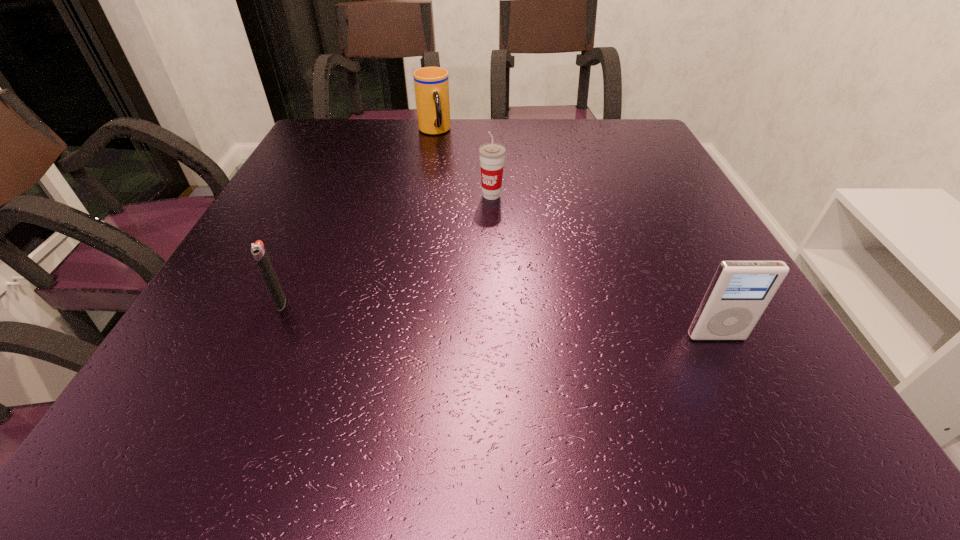
Identify the location of vacant space on the desktop that is between the third farthest object and the rightmost object and is positioned on the side of the left cup with the handle. The width and height of the screenshot is (960, 540). (530, 322).

Where is `free space on the desktop that is between the second nearest object and the nearest object and is positioned on the side of the nearer cup with the logo`? This screenshot has width=960, height=540. free space on the desktop that is between the second nearest object and the nearest object and is positioned on the side of the nearer cup with the logo is located at coordinates (468, 317).